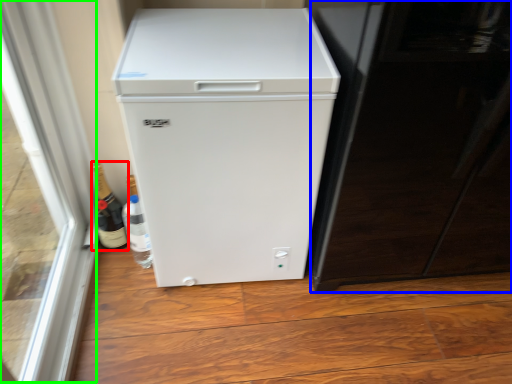
Question: Based on their relative distances, which object is farther from bottle (highlighted by a red box)? Choose from screen door (highlighted by a blue box) and glass door (highlighted by a green box).

Choices:
 (A) screen door
 (B) glass door

Answer: (A)